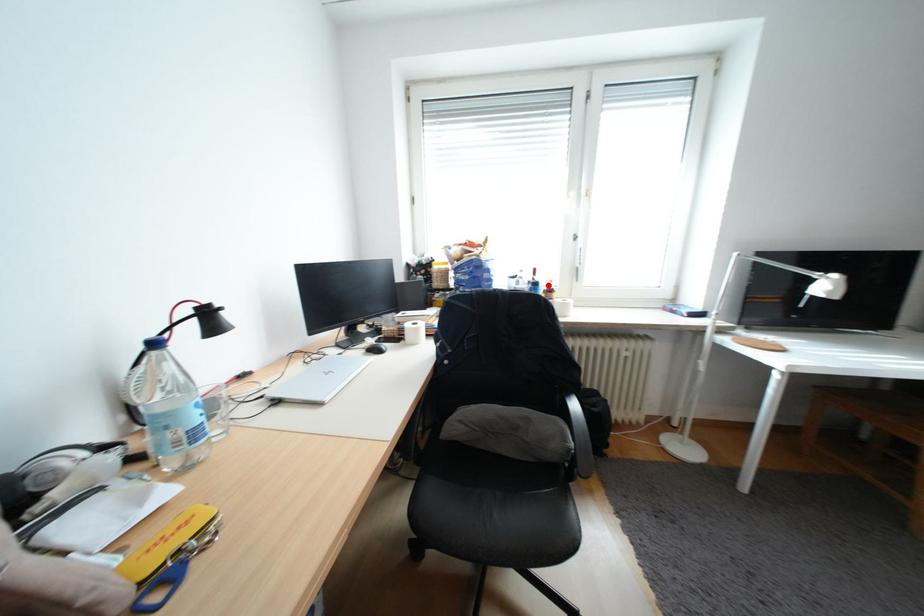
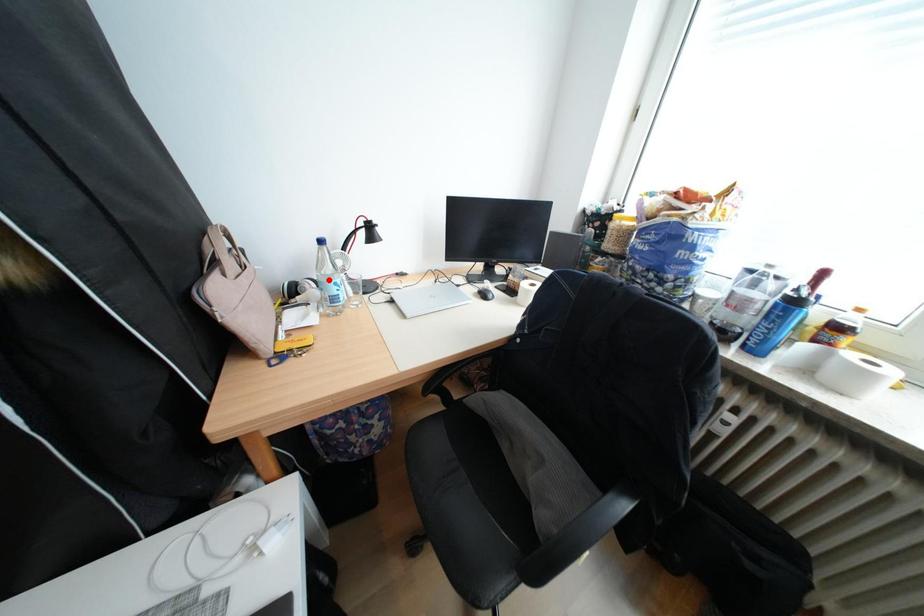
I am providing you with two images of the same scene from different viewpoints. A red point is marked on the first image and another point is marked on the second image. Does the point marked in image1 correspond to the same location as the one in image2?

No